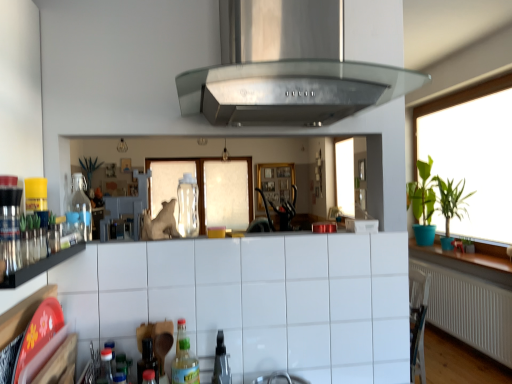
Question: Is black glass shelf at left to the left of green matte plant at right, positioned as the first plant in front-to-back order, from the viewer's perspective?

Choices:
 (A) no
 (B) yes

Answer: (B)

Question: From the image's perspective, is black glass shelf at left above green matte plant at right, positioned as the second plant in back-to-front order?

Choices:
 (A) no
 (B) yes

Answer: (B)

Question: Is black glass shelf at left not inside green matte plant at right, positioned as the second plant in back-to-front order?

Choices:
 (A) no
 (B) yes

Answer: (B)

Question: From a real-world perspective, is black glass shelf at left located beneath green matte plant at right, positioned as the first plant in front-to-back order?

Choices:
 (A) no
 (B) yes

Answer: (A)

Question: Can you confirm if black glass shelf at left is taller than green matte plant at right, positioned as the second plant in back-to-front order?

Choices:
 (A) no
 (B) yes

Answer: (A)

Question: Can you confirm if black glass shelf at left is thinner than green matte plant at right, positioned as the first plant in front-to-back order?

Choices:
 (A) yes
 (B) no

Answer: (A)

Question: From the image's perspective, does green leafy plant at right, positioned as the 2th plant in front-to-back order, appear higher than white tile cabinetry at lower center?

Choices:
 (A) no
 (B) yes

Answer: (A)

Question: Does green leafy plant at right, which is counted as the 1th plant, starting from the back, appear on the left side of white tile cabinetry at lower center?

Choices:
 (A) no
 (B) yes

Answer: (A)

Question: Can you confirm if green leafy plant at right, which is counted as the 1th plant, starting from the back, is thinner than white tile cabinetry at lower center?

Choices:
 (A) no
 (B) yes

Answer: (A)

Question: Is green leafy plant at right, which is counted as the 1th plant, starting from the back, far away from white tile cabinetry at lower center?

Choices:
 (A) yes
 (B) no

Answer: (A)

Question: Is green leafy plant at right, positioned as the 2th plant in front-to-back order, smaller than white tile cabinetry at lower center?

Choices:
 (A) no
 (B) yes

Answer: (B)

Question: Can you confirm if green leafy plant at right, positioned as the 2th plant in front-to-back order, is positioned to the right of white tile cabinetry at lower center?

Choices:
 (A) no
 (B) yes

Answer: (B)

Question: Is the position of green leafy plant at right, which is counted as the 1th plant, starting from the back, more distant than that of green matte plant at right, positioned as the first plant in front-to-back order?

Choices:
 (A) no
 (B) yes

Answer: (B)